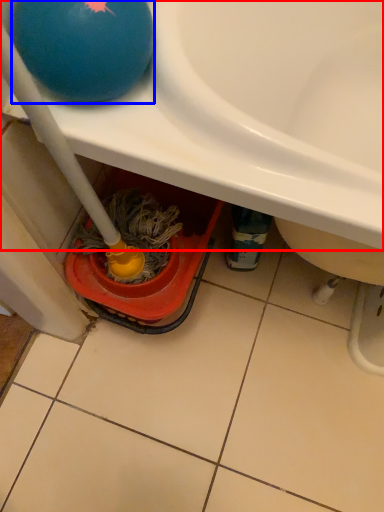
Question: Which of the following is the farthest to the observer, sink (highlighted by a red box) or ball (highlighted by a blue box)?

Choices:
 (A) sink
 (B) ball

Answer: (B)